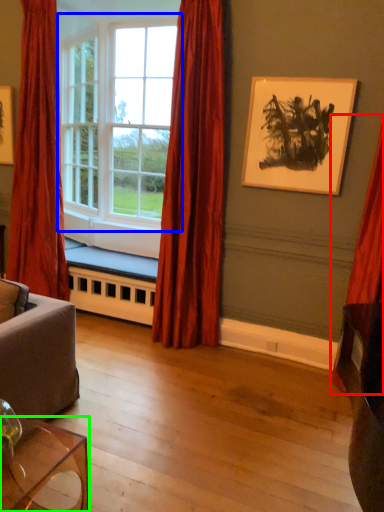
Question: Considering the real-world distances, which object is farthest from curtain (highlighted by a red box)? window (highlighted by a blue box) or table (highlighted by a green box)?

Choices:
 (A) window
 (B) table

Answer: (A)